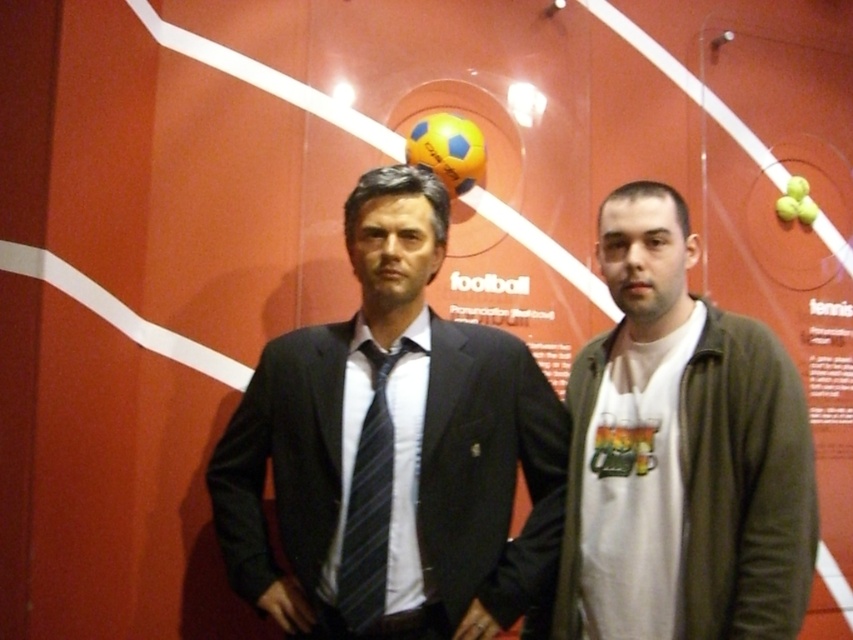
Question: Which object is farther from the camera taking this photo?

Choices:
 (A) black striped tie at center
 (B) white matte t-shirt at center
 (C) dark blue suit at center

Answer: (C)

Question: Which of the following is the closest to the observer?

Choices:
 (A) dark blue suit at center
 (B) white matte t-shirt at center
 (C) black striped tie at center

Answer: (B)

Question: Which of the following is the farthest from the observer?

Choices:
 (A) (521, 596)
 (B) (590, 404)

Answer: (B)

Question: Can you confirm if dark blue suit at center is positioned to the left of black striped tie at center?

Choices:
 (A) no
 (B) yes

Answer: (A)

Question: Can you confirm if dark blue suit at center is positioned above white matte t-shirt at center?

Choices:
 (A) no
 (B) yes

Answer: (B)

Question: Observing the image, what is the correct spatial positioning of dark blue suit at center in reference to black striped tie at center?

Choices:
 (A) left
 (B) right

Answer: (B)